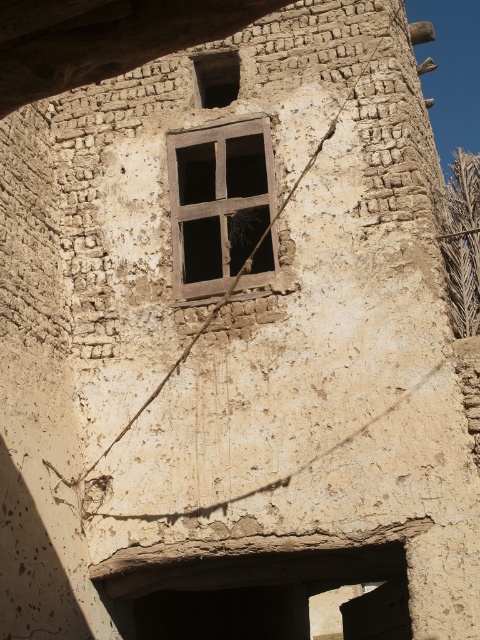
Question: Is wooden window at center in front of brown textured stone window at upper center?

Choices:
 (A) no
 (B) yes

Answer: (B)

Question: Which point appears farthest from the camera in this image?

Choices:
 (A) (214, 157)
 (B) (217, 92)

Answer: (B)

Question: In this image, where is wooden window at center located relative to brown textured stone window at upper center?

Choices:
 (A) above
 (B) below

Answer: (B)

Question: Which point appears closest to the camera in this image?

Choices:
 (A) (187, 168)
 (B) (231, 90)

Answer: (A)

Question: Can you confirm if wooden window at center is positioned to the right of brown textured stone window at upper center?

Choices:
 (A) yes
 (B) no

Answer: (A)

Question: Which point is farther to the camera?

Choices:
 (A) wooden window at center
 (B) brown textured stone window at upper center

Answer: (B)